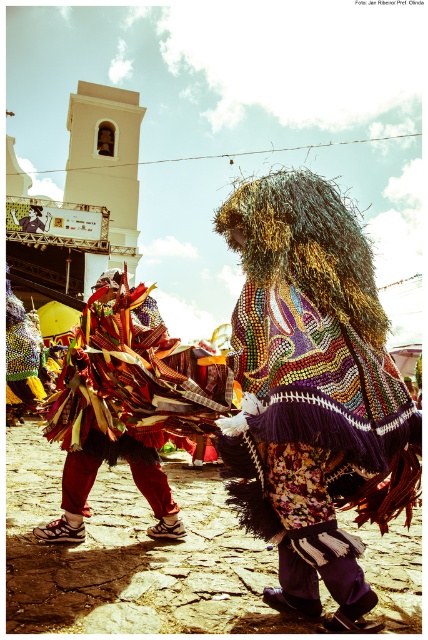
You are a photographer at the event and want to capture a photo of both the beaded fabric cape at center and the bright red fabric at center. Since you can only focus on one object at a time, which one should you focus on first to ensure the other is still in the frame?

The beaded fabric cape at center is to the right of bright red fabric at center, so you should focus on the bright red fabric at center first. This way, the beaded fabric cape at center will still be in the frame to the right of the focused object.

You are a photographer standing at the event. You want to take a closeup shot of the beaded fabric cape at center. What is the minimum distance you should maintain to ensure the camera can focus properly?

The beaded fabric cape at center is 2.18 meters away from the viewer. To take a closeup shot, you should ensure the camera is at least 2.18 meters away to maintain focus.